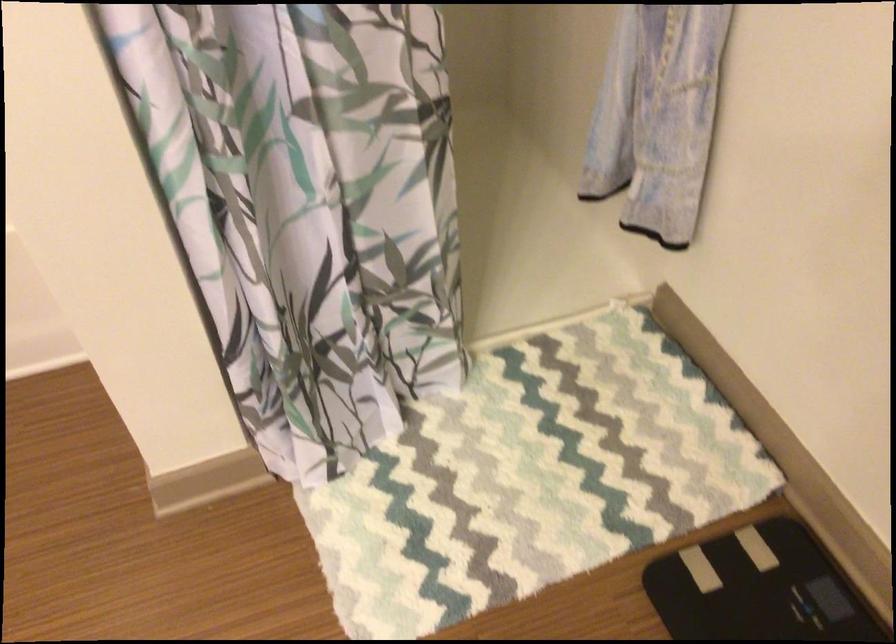
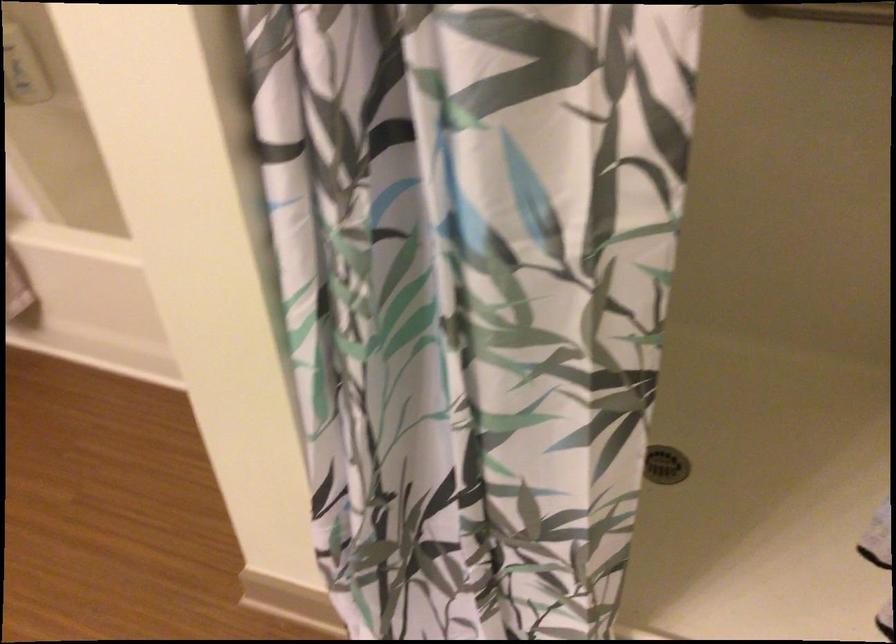
Question: Based on the continuous images, in which direction is the camera rotating? Reply with the corresponding letter.

Choices:
 (A) Left
 (B) Right
 (C) Up
 (D) Down

Answer: (A)